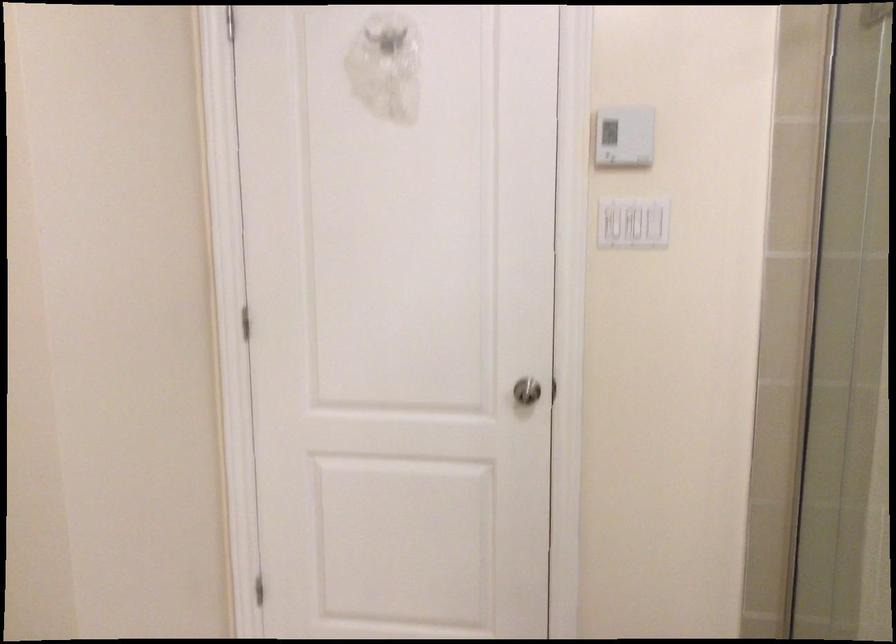
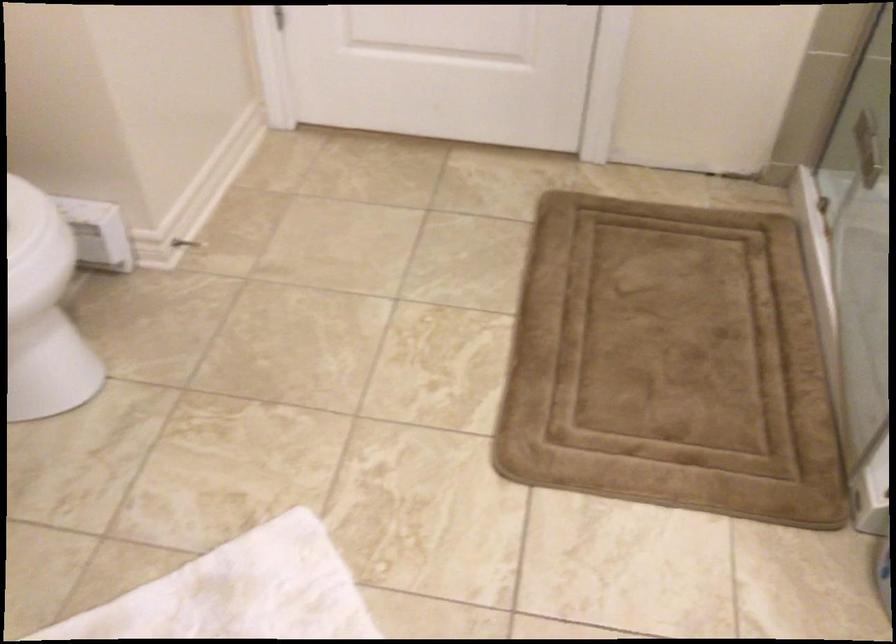
Question: Based on the continuous images, in which direction is the camera rotating? Reply with the corresponding letter.

Choices:
 (A) Left
 (B) Right
 (C) Up
 (D) Down

Answer: (D)